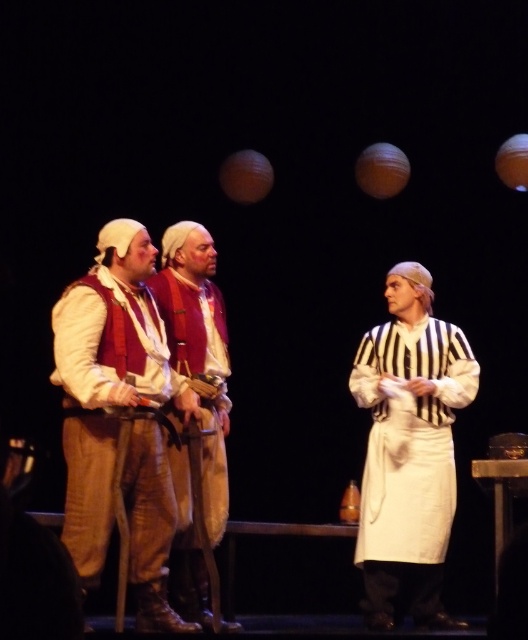
Question: Among these points, which one is farthest from the camera?

Choices:
 (A) (227, 349)
 (B) (378, 332)
 (C) (84, 365)

Answer: (B)

Question: Does matte brown vest at center come in front of matte red vest at center?

Choices:
 (A) no
 (B) yes

Answer: (B)

Question: Among these points, which one is farthest from the camera?

Choices:
 (A) (184, 509)
 (B) (435, 385)
 (C) (78, 493)

Answer: (B)

Question: Does white striped shirt at right appear under matte red vest at center?

Choices:
 (A) no
 (B) yes

Answer: (B)

Question: Does white striped shirt at right come behind matte brown vest at center?

Choices:
 (A) yes
 (B) no

Answer: (A)

Question: Which object is positioned closest to the white striped shirt at right?

Choices:
 (A) matte brown vest at center
 (B) matte red vest at center

Answer: (B)